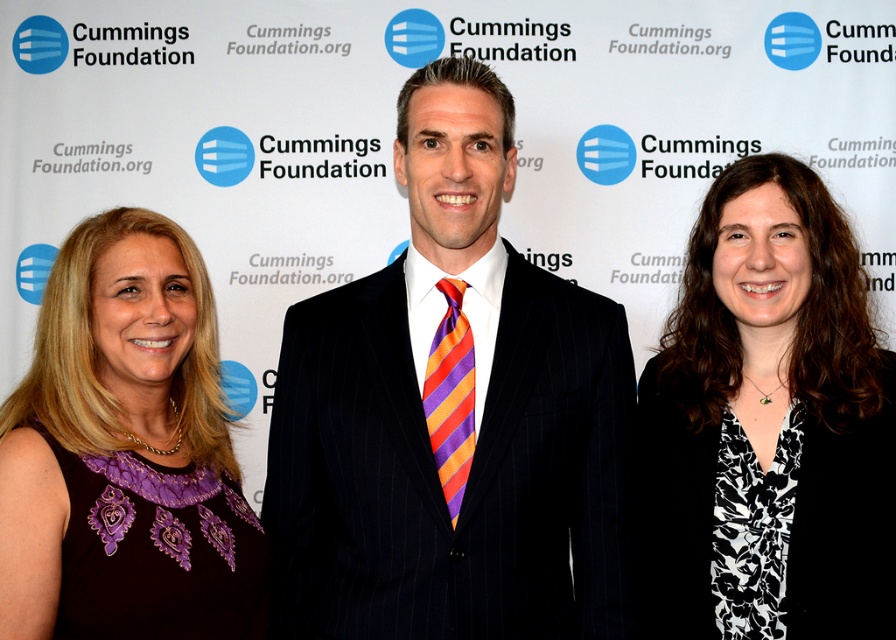
You are attending an event and need to choose an outfit that matches the color scheme of the Cummings Foundation backdrop. The backdrop has blue with horizontal lines. You see the purple embroidered dress at left and the orange and purple striped tie at center. Which item has a larger size?

The purple embroidered dress at left is bigger than the orange and purple striped tie at center, so the purple embroidered dress at left is the larger item.

You are standing in front of the Cummings Foundation backdrop and want to locate the purple embroidered dress at left. According to the coordinates provided, where exactly should you look?

The purple embroidered dress at left is located at point [134,442].

You are standing in front of the Cummings Foundation backdrop. You need to locate the black pinstripe suit at center. Where exactly is it positioned relative to the backdrop?

The black pinstripe suit at center is positioned at coordinates point 0.650 on the x axis and 0.504 on the y axis relative to the backdrop.